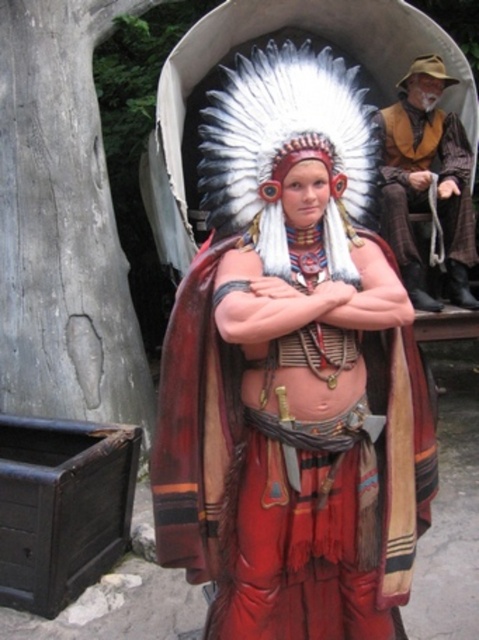
Question: In this image, where is matte red fabric at center located relative to leather vest at upper right?

Choices:
 (A) right
 (B) left

Answer: (B)

Question: Does matte red fabric at center have a larger size compared to leather vest at upper right?

Choices:
 (A) no
 (B) yes

Answer: (B)

Question: Which point appears closest to the camera in this image?

Choices:
 (A) (377, 307)
 (B) (421, 106)

Answer: (A)

Question: Can you confirm if matte red fabric at center is thinner than leather vest at upper right?

Choices:
 (A) no
 (B) yes

Answer: (A)